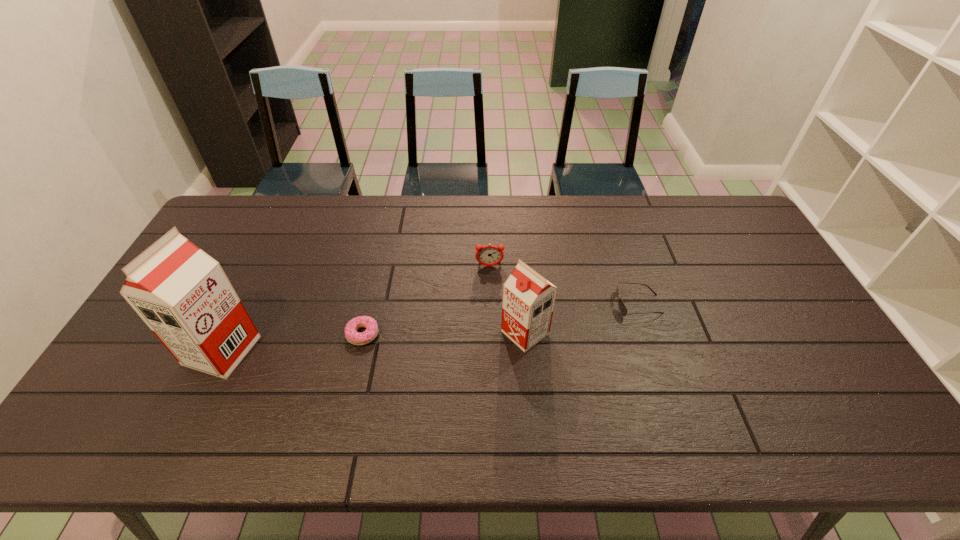
This screenshot has width=960, height=540. Find the location of `free region at the far edge`. free region at the far edge is located at coordinates (584, 219).

The height and width of the screenshot is (540, 960). I want to click on vacant space at the near edge of the desktop, so click(x=591, y=382).

Image resolution: width=960 pixels, height=540 pixels. Find the location of `free location at the right edge of the desktop`. free location at the right edge of the desktop is located at coordinates (777, 276).

Locate an element on the screen. vacant space at the far left corner of the desktop is located at coordinates (252, 196).

This screenshot has width=960, height=540. I want to click on vacant area that lies between the sunglasses and the leftmost object, so click(x=430, y=327).

The width and height of the screenshot is (960, 540). I want to click on unoccupied area between the doughnut and the sunglasses, so 500,319.

Identify the location of vacant space that's between the fourth tallest object and the taller soya milk. The height and width of the screenshot is (540, 960). (430, 327).

Locate an element on the screen. The image size is (960, 540). vacant point located between the doughnut and the right soya milk is located at coordinates (444, 333).

At what (x,y) coordinates should I click in order to perform the action: click on vacant point located between the left soya milk and the shorter soya milk. Please return your answer as a coordinate pair (x, y). This screenshot has width=960, height=540. Looking at the image, I should click on (373, 342).

Where is `empty location between the second shortest object and the right soya milk`? The height and width of the screenshot is (540, 960). empty location between the second shortest object and the right soya milk is located at coordinates (582, 319).